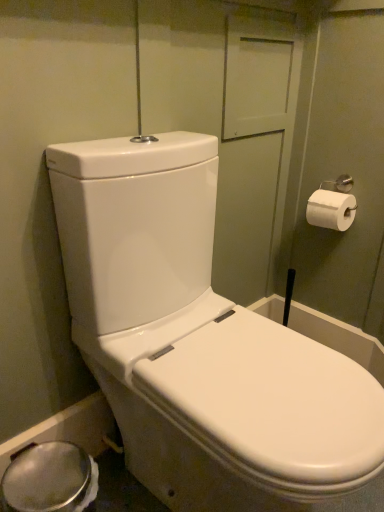
Question: Is white glossy toilet at center in front of or behind white paper at upper right in the image?

Choices:
 (A) front
 (B) behind

Answer: (A)

Question: Is point (x=137, y=411) closer or farther from the camera than point (x=354, y=207)?

Choices:
 (A) closer
 (B) farther

Answer: (A)

Question: In terms of width, does white glossy toilet at center look wider or thinner when compared to white paper at upper right?

Choices:
 (A) wide
 (B) thin

Answer: (A)

Question: Based on their sizes in the image, would you say white paper at upper right is bigger or smaller than white glossy toilet at center?

Choices:
 (A) big
 (B) small

Answer: (B)

Question: Which is correct: white paper at upper right is inside white glossy toilet at center, or outside of it?

Choices:
 (A) inside
 (B) outside

Answer: (B)

Question: Does point (314, 205) appear closer or farther from the camera than point (352, 455)?

Choices:
 (A) closer
 (B) farther

Answer: (B)

Question: In the image, is white paper at upper right positioned in front of or behind white glossy toilet at center?

Choices:
 (A) front
 (B) behind

Answer: (B)